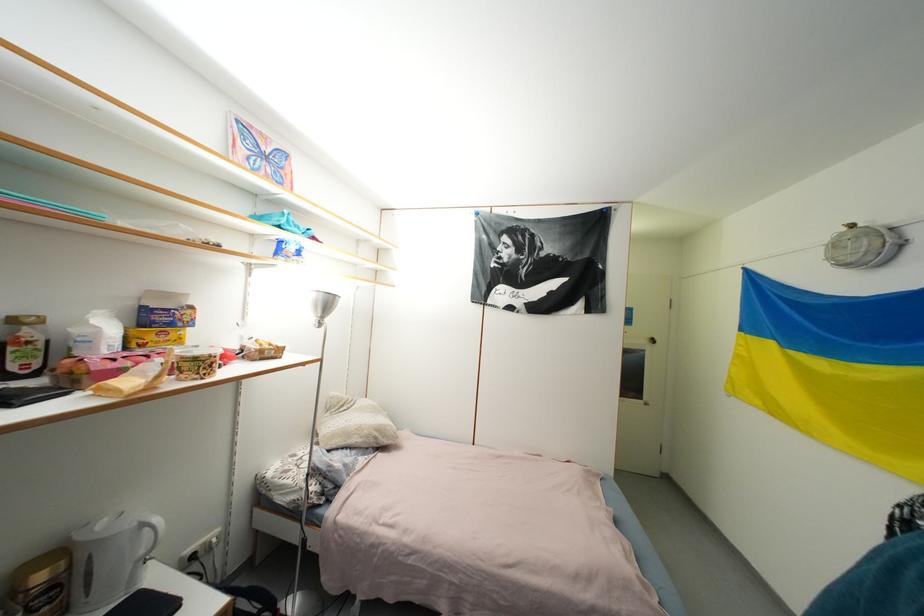
Describe the element at coordinates (322, 306) in the screenshot. I see `the silver lamp head` at that location.